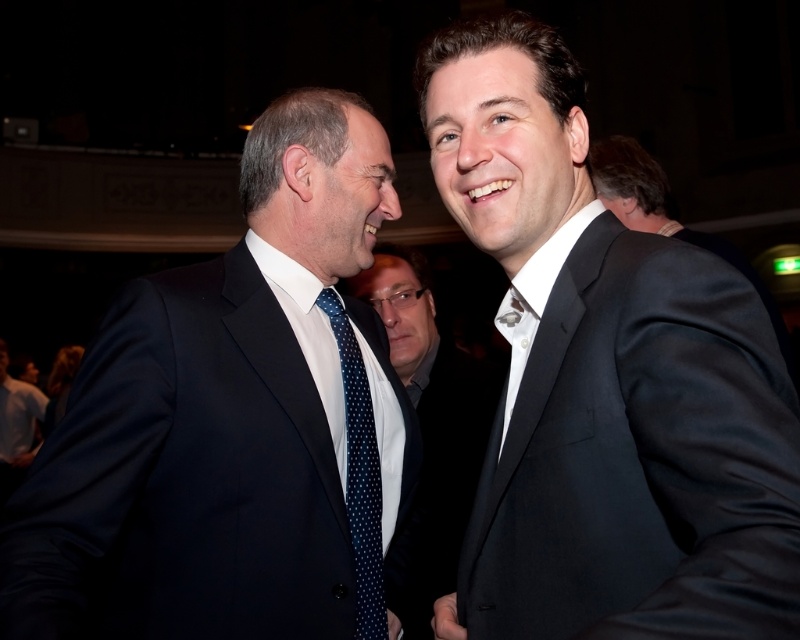
Does black satin suit at center appear on the left side of matte black suit at left?

No, black satin suit at center is not to the left of matte black suit at left.

Does black satin suit at center have a larger size compared to matte black suit at left?

No, black satin suit at center is not bigger than matte black suit at left.

Who is more forward, (656,480) or (252,476)?

Point (656,480)

At what (x,y) coordinates should I click in order to perform the action: click on black satin suit at center. Please return your answer as a coordinate pair (x, y). This screenshot has width=800, height=640. Looking at the image, I should click on (605, 381).

How much distance is there between polka dot tie at center and matte black suit at lower left?

22.96 meters

Does polka dot tie at center have a greater width compared to matte black suit at lower left?

Yes.

Where is `polka dot tie at center`? polka dot tie at center is located at coordinates (432, 413).

Where is `polka dot tie at center`? Image resolution: width=800 pixels, height=640 pixels. polka dot tie at center is located at coordinates (432, 413).

Does matte black suit at left have a larger size compared to matte black suit at lower left?

Yes.

Between point (74, 566) and point (26, 388), which one is positioned behind?

The point (26, 388) is behind.

Is point (30, 513) positioned after point (4, 371)?

No, it is not.

Locate an element on the screen. This screenshot has width=800, height=640. matte black suit at left is located at coordinates (232, 422).